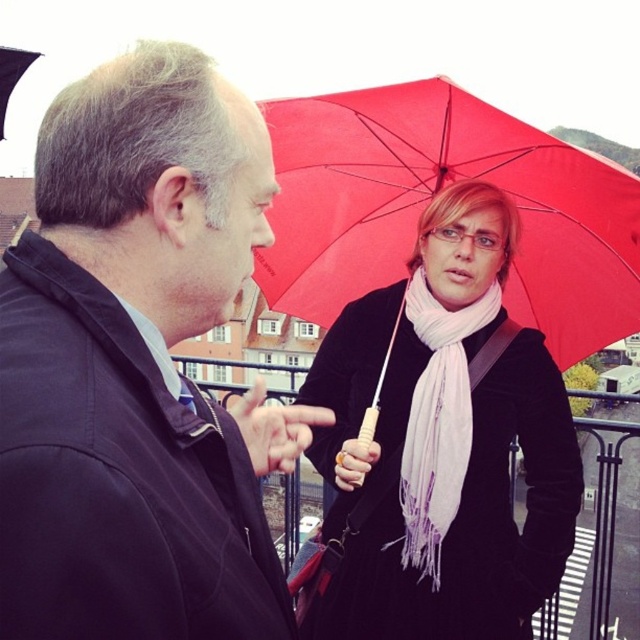
In the scene shown: You are standing on the balcony and want to place a small potted plant exactly where the matte black jacket at left is located. Is this possible?

Yes, since the matte black jacket at left is located at coordinates point (138,368), you can place the potted plant there.

You are standing on a balcony and want to move from the matte black jacket at left to the red matte umbrella at upper right. Which direction should you move to reach the umbrella?

Since the matte black jacket at left is in front of the red matte umbrella at upper right, you should move backward to reach the umbrella.

You are standing on a balcony with a metal railing. You see a matte black jacket at left and a red matte umbrella at upper right. Which object is positioned higher from the ground?

The red matte umbrella at upper right is positioned higher from the ground than the matte black jacket at left.